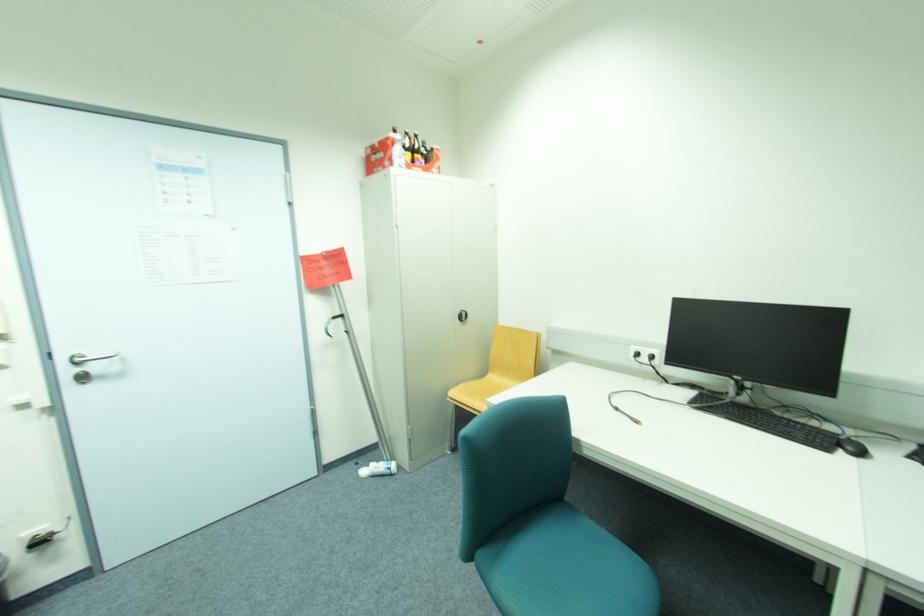
This screenshot has height=616, width=924. I want to click on grabber tool handle, so click(x=331, y=323).